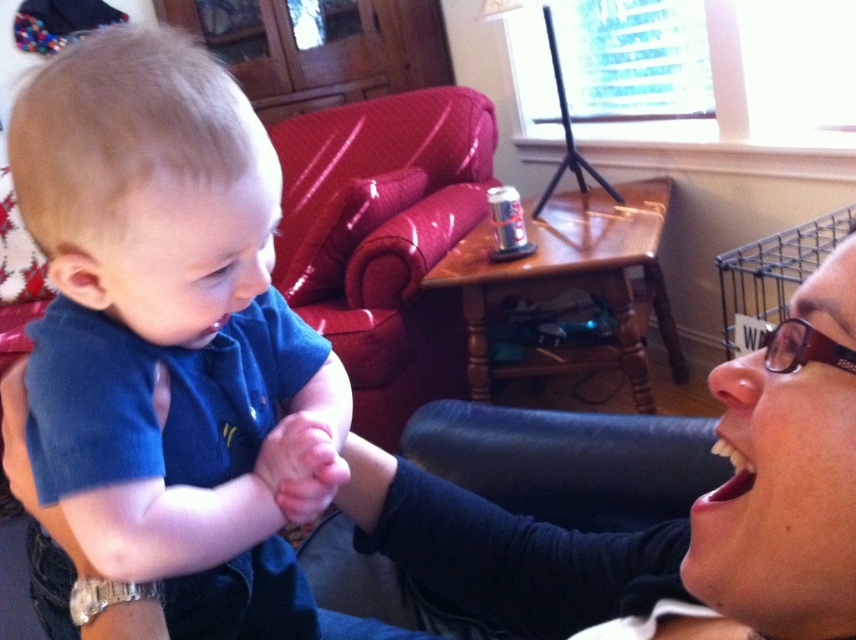
Can you confirm if glossy vinyl armchair at upper center is positioned above matte black glasses at lower right?

Correct, glossy vinyl armchair at upper center is located above matte black glasses at lower right.

This screenshot has width=856, height=640. Identify the location of glossy vinyl armchair at upper center. (382, 237).

What do you see at coordinates (382, 237) in the screenshot?
I see `glossy vinyl armchair at upper center` at bounding box center [382, 237].

Locate an element on the screen. glossy vinyl armchair at upper center is located at coordinates (382, 237).

Can you confirm if blue soft fabric baby at center is shorter than smooth skin hand at center?

In fact, blue soft fabric baby at center may be taller than smooth skin hand at center.

Does blue soft fabric baby at center have a smaller size compared to smooth skin hand at center?

No.

Which is in front, point (84, 131) or point (278, 445)?

Point (84, 131)

Where is `blue soft fabric baby at center`? This screenshot has height=640, width=856. blue soft fabric baby at center is located at coordinates (x=175, y=328).

What do you see at coordinates (634, 531) in the screenshot? I see `matte black shirt at lower right` at bounding box center [634, 531].

Consider the image. Can you confirm if matte black shirt at lower right is positioned to the left of glossy vinyl armchair at upper center?

In fact, matte black shirt at lower right is to the right of glossy vinyl armchair at upper center.

Is point (770, 362) closer to camera compared to point (343, 112)?

Yes.

Image resolution: width=856 pixels, height=640 pixels. I want to click on matte black shirt at lower right, so click(x=634, y=531).